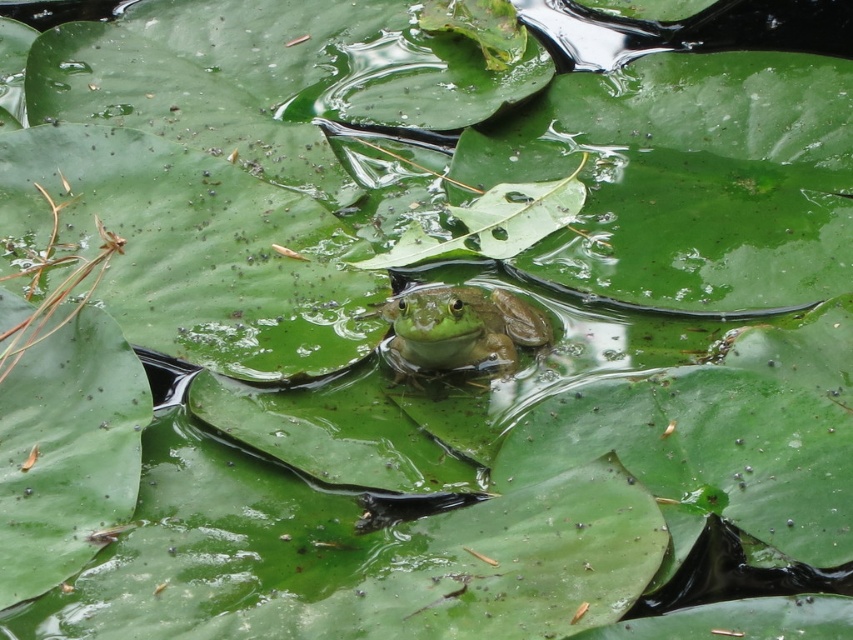
You are a photographer trying to capture a closeup of the green matte tree frog at center and the green matte leaf at center. Which object will appear smaller in your photo?

The green matte tree frog at center will appear smaller in the photo because it has a lesser width compared to the green matte leaf at center.

You are a photographer trying to capture a closeup shot of the green matte tree frog at center and the green matte leaf at center. Your camera has a maximum focus range of 8 inches. Can you focus on both subjects simultaneously?

The green matte tree frog at center is 8.36 inches away from the green matte leaf at center. Since the distance between them exceeds the camera maximum focus range of 8 inches, you cannot focus on both subjects simultaneously.

You are a photographer trying to capture a frog and a leaf in the same frame. You see the green matte tree frog at center and the green matte leaf at center. Which one is positioned to the left?

The green matte tree frog at center is positioned to the left of the green matte leaf at center.